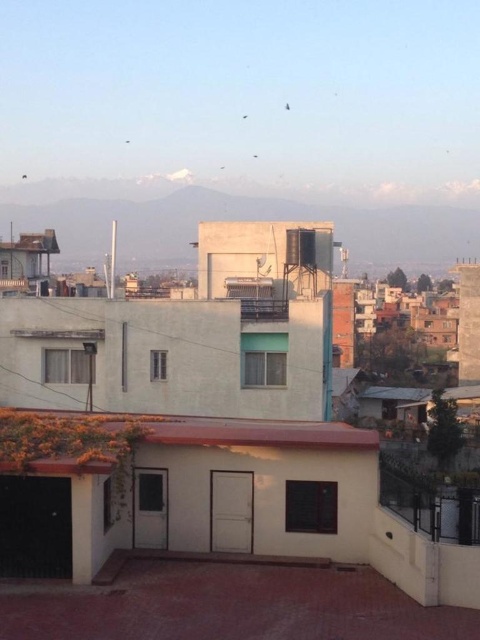
Question: Is white snow-covered mountain at upper center bigger than brown matte roof at center?

Choices:
 (A) yes
 (B) no

Answer: (A)

Question: Can you confirm if white snow-covered mountain at upper center is wider than brown matte roof at center?

Choices:
 (A) yes
 (B) no

Answer: (A)

Question: Which of the following is the farthest from the observer?

Choices:
 (A) (340, 230)
 (B) (367, 432)

Answer: (A)

Question: Observing the image, what is the correct spatial positioning of white snow-covered mountain at upper center in reference to brown matte roof at center?

Choices:
 (A) above
 (B) below

Answer: (A)

Question: Which object is farther from the camera taking this photo?

Choices:
 (A) brown matte roof at center
 (B) white snow-covered mountain at upper center

Answer: (B)

Question: Which point is farther to the camera?

Choices:
 (A) (226, 220)
 (B) (228, 420)

Answer: (A)